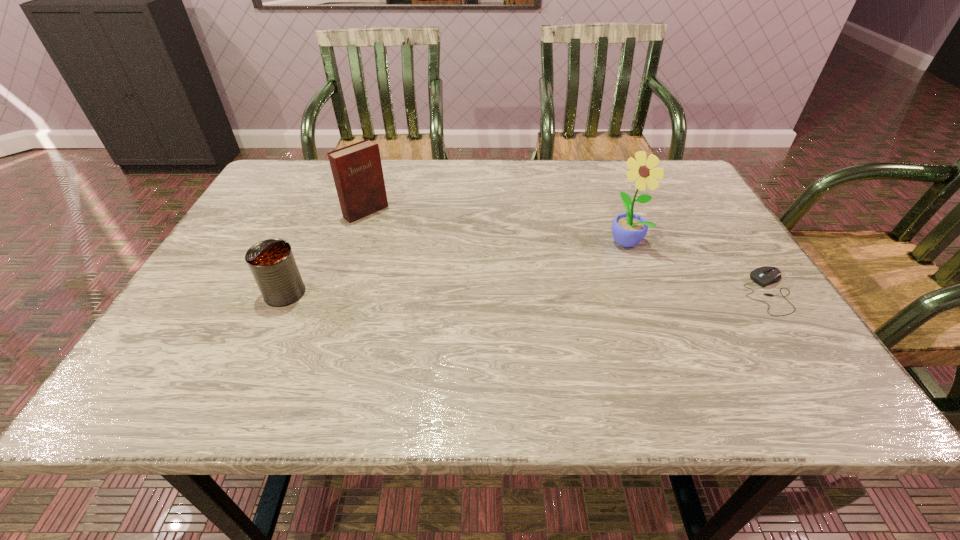
In order to click on vacant space situated on the front-facing side of the third object from left to right in this screenshot , I will do `click(515, 329)`.

In order to click on free location located on the front-facing side of the third object from left to right in this screenshot , I will do `click(580, 279)`.

Identify the location of free space located 0.250m on the front-facing side of the third object from left to right. (547, 304).

What are the coordinates of `free space located on the front cover of the diary` in the screenshot? It's located at (450, 281).

I want to click on vacant space located on the front cover of the diary, so click(481, 306).

In order to click on free space located 0.120m on the front cover of the diary in this screenshot , I will do `click(404, 242)`.

Identify the location of object that is at the far edge. This screenshot has height=540, width=960. (357, 171).

The width and height of the screenshot is (960, 540). I want to click on object situated at the left edge, so [272, 263].

This screenshot has width=960, height=540. What are the coordinates of `object present at the right edge` in the screenshot? It's located at (763, 276).

Image resolution: width=960 pixels, height=540 pixels. I want to click on free spot at the far edge of the desktop, so click(x=520, y=160).